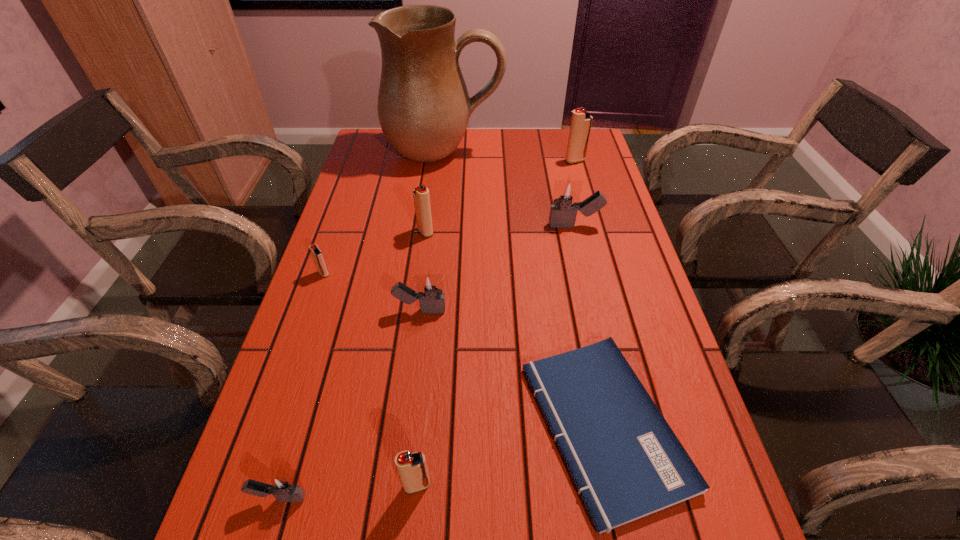
In the image, there is a desktop. Find the location of `vacant space at the far edge`. vacant space at the far edge is located at coordinates (477, 137).

In order to click on vacant space at the left edge in this screenshot , I will do coord(321,277).

The width and height of the screenshot is (960, 540). Identify the location of vacant space at the right edge of the desktop. (681, 529).

In the image, there is a desktop. Where is `free region at the far right corner`? free region at the far right corner is located at coordinates (560, 141).

Find the location of a particular element. blank region between the cream pitcher and the third smallest red igniter is located at coordinates (435, 192).

The width and height of the screenshot is (960, 540). Find the location of `free point between the cream pitcher and the smallest gray igniter`. free point between the cream pitcher and the smallest gray igniter is located at coordinates (362, 325).

Where is `free space between the second smallest red igniter and the second farthest red igniter`? This screenshot has height=540, width=960. free space between the second smallest red igniter and the second farthest red igniter is located at coordinates (421, 359).

The width and height of the screenshot is (960, 540). I want to click on unoccupied position between the farthest gray igniter and the cream pitcher, so click(x=509, y=188).

Locate an element on the screen. This screenshot has height=540, width=960. free area in between the farthest igniter and the third nearest red igniter is located at coordinates (500, 197).

Find the location of a particular element. free space between the smallest gray igniter and the sixth farthest object is located at coordinates (350, 404).